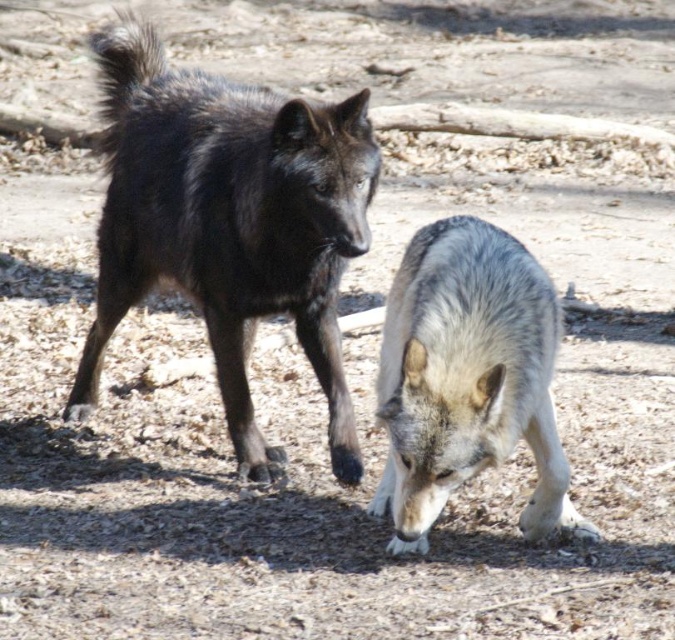
You are a wildlife photographer trying to capture both the shiny black fur at center and the gray fur wolf at lower center in a single frame. Which wolf should you focus on to ensure both are in the shot without zooming in too much?

The shiny black fur at center is wider than the gray fur wolf at lower center, so focusing on the shiny black fur at center will help ensure both are captured in the frame without excessive zooming.

You are a wildlife photographer aiming to capture the wolves in the scene. You notice a point of interest at coordinates point (227, 224). What is located at this point?

The point (227, 224) corresponds to shiny black fur at center.

You are a wildlife photographer trying to capture a closeup shot of both the shiny black fur at center and the gray fur wolf at lower center. Your camera has a maximum focus range of 50 centimeters. Can you capture both subjects in one shot without moving your camera?

The shiny black fur at center is 55.72 centimeters away from the gray fur wolf at lower center. Since the distance between them exceeds the camera maximum focus range of 50 centimeters, you cannot capture both subjects in one shot without moving your camera.